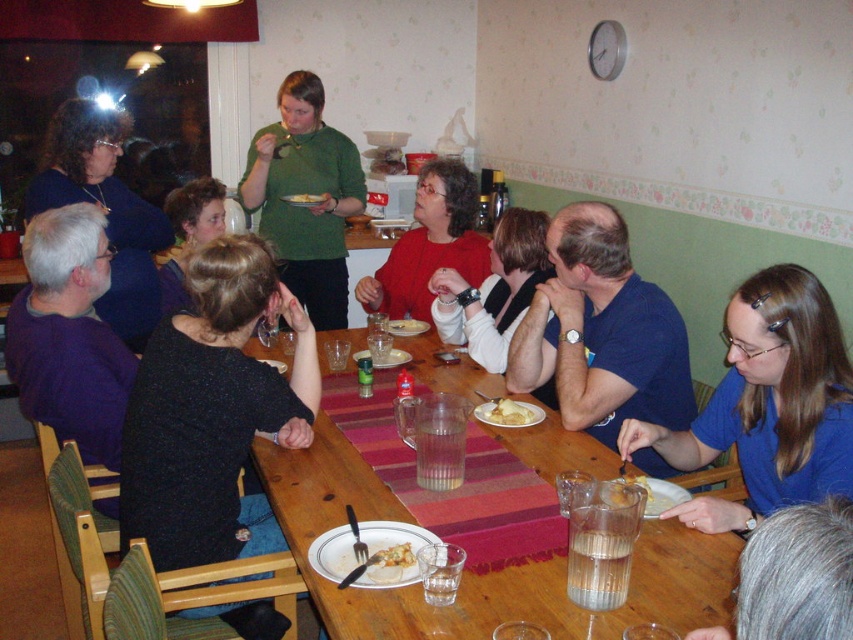
Consider the image. You are standing at the dining table in the image and want to move from the point at coordinates point (511, 589) to the point at coordinates point (772, 483). Which direction should you move to get closer to your destination?

To move from point (511, 589) to point (772, 483), you should move upward because point (511, 589) is in front of point (772, 483), indicating that the destination is behind the starting point.

In the scene described, there is a point labeled as point [105,211]. Which object in the image corresponds to this coordinate?

The point [105,211] corresponds to the matte black sweater at upper left.